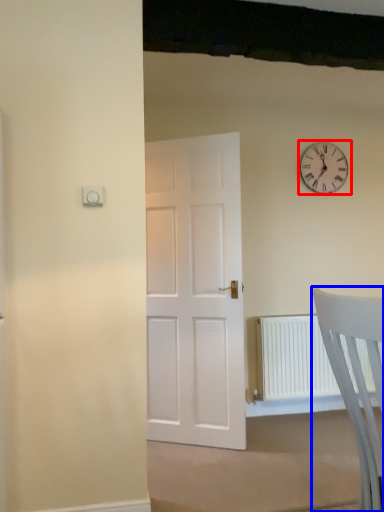
Question: Among these objects, which one is farthest to the camera, wall clock (highlighted by a red box) or chair (highlighted by a blue box)?

Choices:
 (A) wall clock
 (B) chair

Answer: (A)